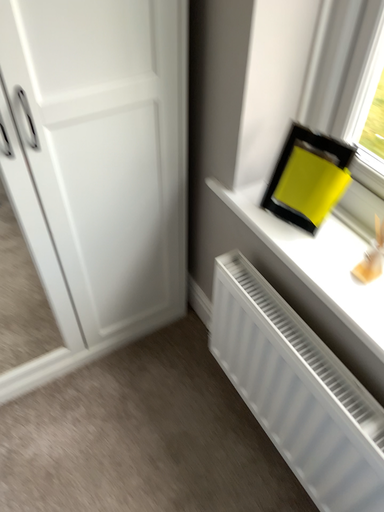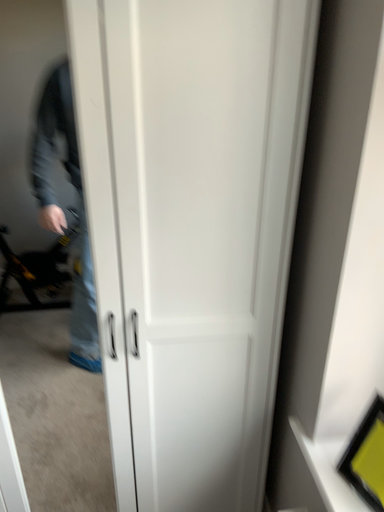
Question: How did the camera likely rotate when shooting the video?

Choices:
 (A) rotated right
 (B) rotated left

Answer: (B)